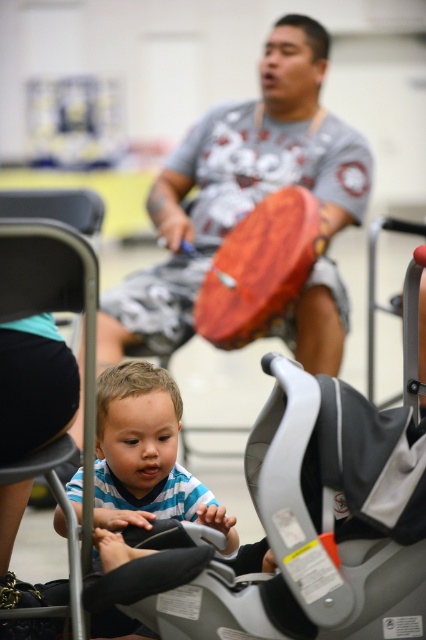
Who is more distant from viewer, (302,116) or (138,397)?

Point (302,116)

Between gray cotton t-shirt at center and blue striped shirt at lower left, which one is positioned higher?

Positioned higher is gray cotton t-shirt at center.

The height and width of the screenshot is (640, 426). Describe the element at coordinates (239, 182) in the screenshot. I see `gray cotton t-shirt at center` at that location.

Locate an element on the screen. gray cotton t-shirt at center is located at coordinates (239, 182).

Between gray cotton t-shirt at center and black fabric chair at lower left, which one has more height?

With more height is gray cotton t-shirt at center.

Can you confirm if gray cotton t-shirt at center is wider than black fabric chair at lower left?

Indeed, gray cotton t-shirt at center has a greater width compared to black fabric chair at lower left.

Where is `gray cotton t-shirt at center`? gray cotton t-shirt at center is located at coordinates (239, 182).

Where is `gray cotton t-shirt at center`? Image resolution: width=426 pixels, height=640 pixels. gray cotton t-shirt at center is located at coordinates (239, 182).

Is point (265, 506) closer to camera compared to point (158, 480)?

Yes, point (265, 506) is in front of point (158, 480).

Which of these two, gray plastic baby carriage at center or blue striped shirt at lower left, stands shorter?

Standing shorter between the two is blue striped shirt at lower left.

Between point (327, 502) and point (103, 380), which one is positioned behind?

Positioned behind is point (103, 380).

This screenshot has width=426, height=640. What are the coordinates of `gray plastic baby carriage at center` in the screenshot? It's located at (298, 531).